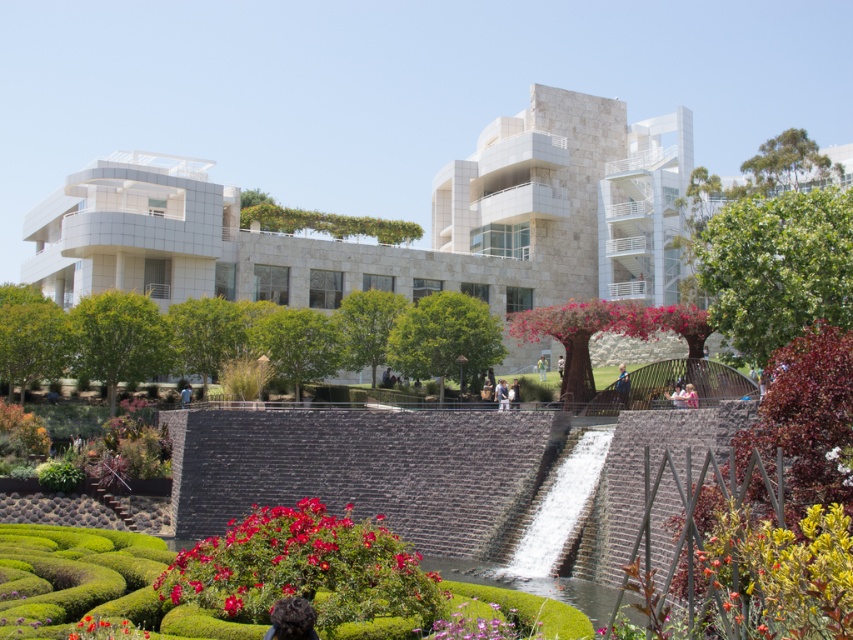
Question: Considering the relative positions of green leafy hedge at right and yellow-green succulent at lower right in the image provided, where is green leafy hedge at right located with respect to yellow-green succulent at lower right?

Choices:
 (A) above
 (B) below

Answer: (A)

Question: Which is farther from the green leafy hedge at right?

Choices:
 (A) vivid red petals at center
 (B) pink matte tree at center

Answer: (A)

Question: Can you confirm if vivid red petals at center is wider than pink matte tree at center?

Choices:
 (A) no
 (B) yes

Answer: (A)

Question: Which of the following is the closest to the observer?

Choices:
 (A) (94, 636)
 (B) (621, 301)
 (C) (782, 595)

Answer: (C)

Question: Which object appears farthest from the camera in this image?

Choices:
 (A) yellow-green succulent at lower right
 (B) green leafy hedge at right

Answer: (B)

Question: Is yellow-green succulent at lower right positioned in front of pink matte tree at center?

Choices:
 (A) yes
 (B) no

Answer: (A)